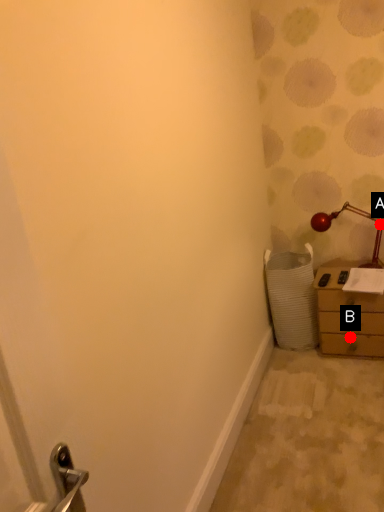
Question: Two points are circled on the image, labeled by A and B beside each circle. Which point appears farthest from the camera in this image?

Choices:
 (A) A is further
 (B) B is further

Answer: (A)